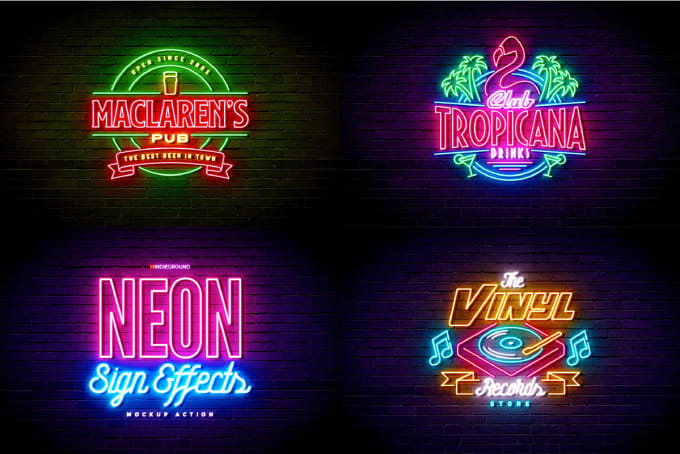
Find the location of a particular element. This screenshot has height=454, width=680. vinyl records sign is located at coordinates (507, 346).